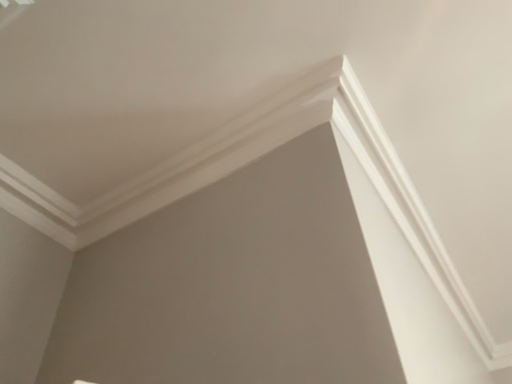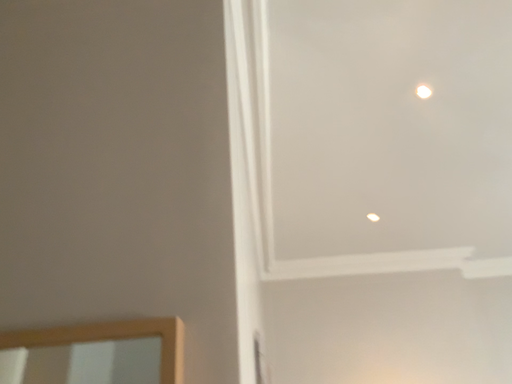
Question: How did the camera likely rotate when shooting the video?

Choices:
 (A) rotated downward
 (B) rotated upward

Answer: (A)